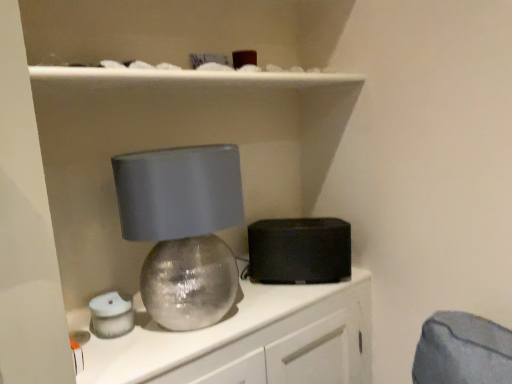
Question: Which is correct: matte gray lampshade at center is inside black matte speaker at center, or outside of it?

Choices:
 (A) inside
 (B) outside

Answer: (B)

Question: From a real-world perspective, is matte gray lampshade at center physically located above or below black matte speaker at center?

Choices:
 (A) above
 (B) below

Answer: (A)

Question: Which is farther from the matte silver sphere at center?

Choices:
 (A) black matte speaker at center
 (B) matte gray lampshade at center

Answer: (B)

Question: Based on their relative distances, which object is farther from the black matte speaker at center?

Choices:
 (A) matte silver sphere at center
 (B) matte gray lampshade at center

Answer: (B)